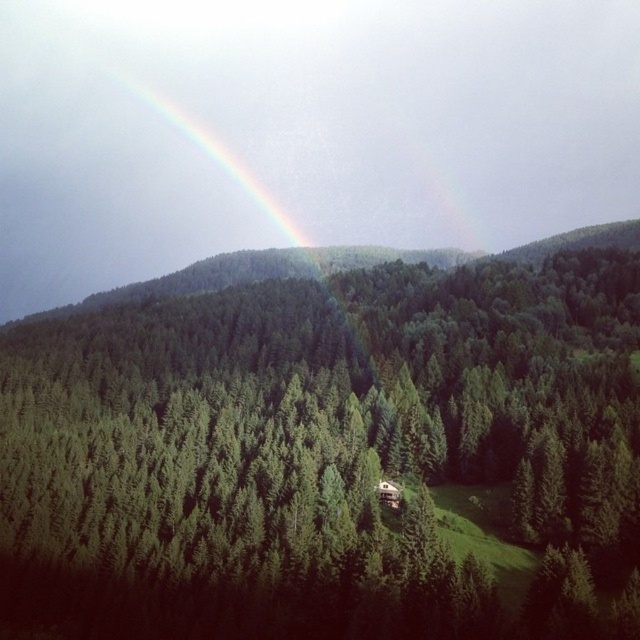
You are standing at the point marked as point (326, 451) in the image. What object is located exactly at that point?

The green matte tree at center is located exactly at point (326, 451).

You are a hiker standing in the forest and looking at the green matte tree at center and the rainbow at upper center. Which object is higher in the scene?

The rainbow at upper center is higher than the green matte tree at center because the green matte tree at center is located below it.